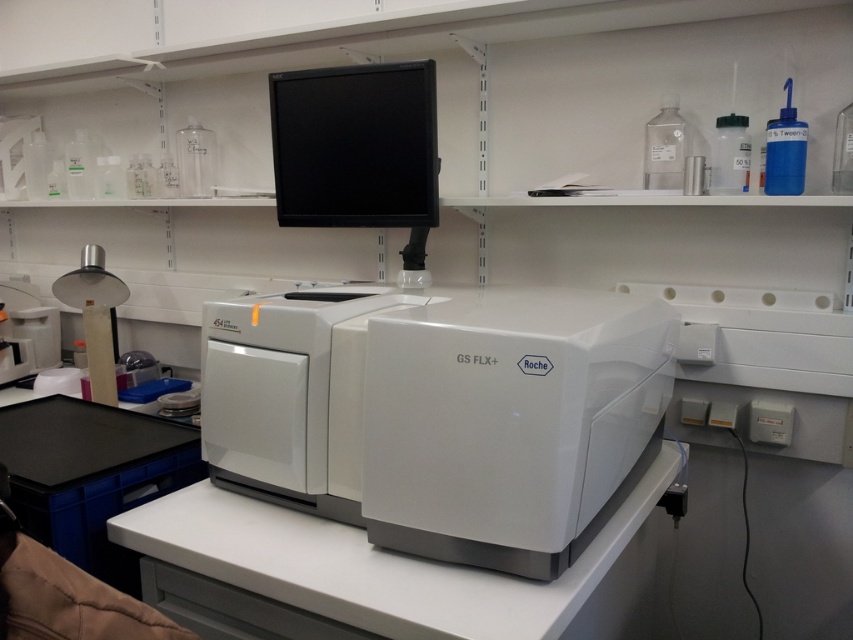
Question: In this image, where is white plastic printer at center located relative to black glossy monitor at upper center?

Choices:
 (A) left
 (B) right

Answer: (B)

Question: Observing the image, what is the correct spatial positioning of white plastic printer at center in reference to black glossy monitor at upper center?

Choices:
 (A) above
 (B) below

Answer: (B)

Question: Is white plastic printer at center thinner than black glossy monitor at upper center?

Choices:
 (A) yes
 (B) no

Answer: (B)

Question: Among these points, which one is nearest to the camera?

Choices:
 (A) (250, 397)
 (B) (418, 99)

Answer: (A)

Question: Which object appears farthest from the camera in this image?

Choices:
 (A) white plastic printer at center
 (B) black glossy monitor at upper center

Answer: (B)